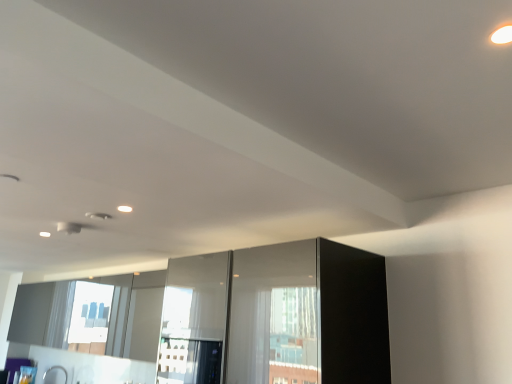
What do you see at coordinates (274, 315) in the screenshot?
I see `glossy glass screen door at center, the 1th screen door positioned from the right` at bounding box center [274, 315].

What is the approximate height of satin nickel faucet at lower left?

18.05 centimeters.

I want to click on glossy glass screen door at center, placed as the second screen door when sorted from left to right, so click(x=274, y=315).

Measure the distance between transparent glass screen door at center, acting as the first screen door starting from the left, and glossy glass screen door at center, the 1th screen door positioned from the right.

They are 13.35 inches apart.

In terms of height, does transparent glass screen door at center, acting as the first screen door starting from the left, look taller or shorter compared to glossy glass screen door at center, placed as the second screen door when sorted from left to right?

Clearly, transparent glass screen door at center, acting as the first screen door starting from the left, is taller compared to glossy glass screen door at center, placed as the second screen door when sorted from left to right.

Which is closer to the camera, (219, 283) or (253, 359)?

Point (219, 283) is positioned farther from the camera compared to point (253, 359).

You are a GUI agent. You are given a task and a screenshot of the screen. Output one action in this format:
    pyautogui.click(x=<x>, y=<y>)
    Task: Click on the screen door above the transparent glass screen door at center, acting as the first screen door starting from the left (from the image's perspective)
    Image resolution: width=512 pixels, height=384 pixels.
    Given the screenshot: What is the action you would take?
    pyautogui.click(x=274, y=315)

Is satin nickel faucet at lower left surrounding transparent glass screen door at center, which ranks as the second screen door in right-to-left order?

Actually, transparent glass screen door at center, which ranks as the second screen door in right-to-left order, is outside satin nickel faucet at lower left.

Measure the distance from satin nickel faucet at lower left to transparent glass screen door at center, which ranks as the second screen door in right-to-left order.

A distance of 12.17 feet exists between satin nickel faucet at lower left and transparent glass screen door at center, which ranks as the second screen door in right-to-left order.

Are satin nickel faucet at lower left and transparent glass screen door at center, acting as the first screen door starting from the left, making contact?

No, satin nickel faucet at lower left is not touching transparent glass screen door at center, acting as the first screen door starting from the left.

Visually, is transparent glass screen door at center, which ranks as the second screen door in right-to-left order, positioned to the left or to the right of satin nickel faucet at lower left?

In the image, transparent glass screen door at center, which ranks as the second screen door in right-to-left order, appears on the right side of satin nickel faucet at lower left.

Where is `faucet on the left of the transparent glass screen door at center, acting as the first screen door starting from the left`? This screenshot has width=512, height=384. faucet on the left of the transparent glass screen door at center, acting as the first screen door starting from the left is located at coordinates click(54, 374).

From a real-world perspective, is glossy glass screen door at center, placed as the second screen door when sorted from left to right, located higher than satin nickel faucet at lower left?

Indeed, from a real-world perspective, glossy glass screen door at center, placed as the second screen door when sorted from left to right, stands above satin nickel faucet at lower left.

Where is `faucet beneath the glossy glass screen door at center, placed as the second screen door when sorted from left to right (from a real-world perspective)`? This screenshot has height=384, width=512. faucet beneath the glossy glass screen door at center, placed as the second screen door when sorted from left to right (from a real-world perspective) is located at coordinates (54, 374).

Between glossy glass screen door at center, the 1th screen door positioned from the right, and satin nickel faucet at lower left, which one has smaller width?

satin nickel faucet at lower left is thinner.

From the picture: Considering the relative positions of glossy glass screen door at center, placed as the second screen door when sorted from left to right, and satin nickel faucet at lower left in the image provided, is glossy glass screen door at center, placed as the second screen door when sorted from left to right, to the right of satin nickel faucet at lower left from the viewer's perspective?

Indeed, glossy glass screen door at center, placed as the second screen door when sorted from left to right, is positioned on the right side of satin nickel faucet at lower left.

Is satin nickel faucet at lower left oriented towards glossy glass screen door at center, the 1th screen door positioned from the right?

No, satin nickel faucet at lower left is not oriented towards glossy glass screen door at center, the 1th screen door positioned from the right.

Can you tell me how much satin nickel faucet at lower left and glossy glass screen door at center, placed as the second screen door when sorted from left to right, differ in facing direction?

0.493 degrees.

Considering the relative sizes of satin nickel faucet at lower left and glossy glass screen door at center, the 1th screen door positioned from the right, in the image provided, is satin nickel faucet at lower left taller than glossy glass screen door at center, the 1th screen door positioned from the right,?

No, satin nickel faucet at lower left is not taller than glossy glass screen door at center, the 1th screen door positioned from the right.

Would you say satin nickel faucet at lower left is outside glossy glass screen door at center, the 1th screen door positioned from the right?

Yes, satin nickel faucet at lower left is outside of glossy glass screen door at center, the 1th screen door positioned from the right.

Which object is wider, glossy glass screen door at center, placed as the second screen door when sorted from left to right, or transparent glass screen door at center, which ranks as the second screen door in right-to-left order?

glossy glass screen door at center, placed as the second screen door when sorted from left to right, is wider.

How distant is glossy glass screen door at center, the 1th screen door positioned from the right, from transparent glass screen door at center, which ranks as the second screen door in right-to-left order?

glossy glass screen door at center, the 1th screen door positioned from the right, and transparent glass screen door at center, which ranks as the second screen door in right-to-left order, are 13.35 inches apart from each other.

Which object is closer to the camera, glossy glass screen door at center, placed as the second screen door when sorted from left to right, or transparent glass screen door at center, acting as the first screen door starting from the left?

glossy glass screen door at center, placed as the second screen door when sorted from left to right, is in front.

Are glossy glass screen door at center, placed as the second screen door when sorted from left to right, and transparent glass screen door at center, which ranks as the second screen door in right-to-left order, located far from each other?

No, there isn't a large distance between glossy glass screen door at center, placed as the second screen door when sorted from left to right, and transparent glass screen door at center, which ranks as the second screen door in right-to-left order.

This screenshot has height=384, width=512. Identify the location of screen door on the right side of transparent glass screen door at center, which ranks as the second screen door in right-to-left order. click(x=274, y=315).

Where is `faucet behind the transparent glass screen door at center, acting as the first screen door starting from the left`? The width and height of the screenshot is (512, 384). faucet behind the transparent glass screen door at center, acting as the first screen door starting from the left is located at coordinates (54, 374).

Which object lies further to the anchor point glossy glass screen door at center, the 1th screen door positioned from the right, transparent glass screen door at center, which ranks as the second screen door in right-to-left order, or satin nickel faucet at lower left?

satin nickel faucet at lower left is further to glossy glass screen door at center, the 1th screen door positioned from the right.

In the scene shown: Which object lies nearer to the anchor point glossy glass screen door at center, the 1th screen door positioned from the right, satin nickel faucet at lower left or transparent glass screen door at center, acting as the first screen door starting from the left?

transparent glass screen door at center, acting as the first screen door starting from the left, lies closer to glossy glass screen door at center, the 1th screen door positioned from the right, than the other object.

Which object lies nearer to the anchor point satin nickel faucet at lower left, glossy glass screen door at center, placed as the second screen door when sorted from left to right, or transparent glass screen door at center, which ranks as the second screen door in right-to-left order?

Based on the image, transparent glass screen door at center, which ranks as the second screen door in right-to-left order, appears to be nearer to satin nickel faucet at lower left.

Considering their positions, is satin nickel faucet at lower left positioned closer to transparent glass screen door at center, which ranks as the second screen door in right-to-left order, than glossy glass screen door at center, the 1th screen door positioned from the right?

glossy glass screen door at center, the 1th screen door positioned from the right.

From the image, which object appears to be nearer to satin nickel faucet at lower left, transparent glass screen door at center, acting as the first screen door starting from the left, or glossy glass screen door at center, the 1th screen door positioned from the right?

transparent glass screen door at center, acting as the first screen door starting from the left, lies closer to satin nickel faucet at lower left than the other object.

Considering their positions, is glossy glass screen door at center, placed as the second screen door when sorted from left to right, positioned closer to transparent glass screen door at center, acting as the first screen door starting from the left, than satin nickel faucet at lower left?

glossy glass screen door at center, placed as the second screen door when sorted from left to right, lies closer to transparent glass screen door at center, acting as the first screen door starting from the left, than the other object.

This screenshot has height=384, width=512. What are the coordinates of `screen door located between glossy glass screen door at center, the 1th screen door positioned from the right, and satin nickel faucet at lower left in the depth direction` in the screenshot? It's located at (195, 315).